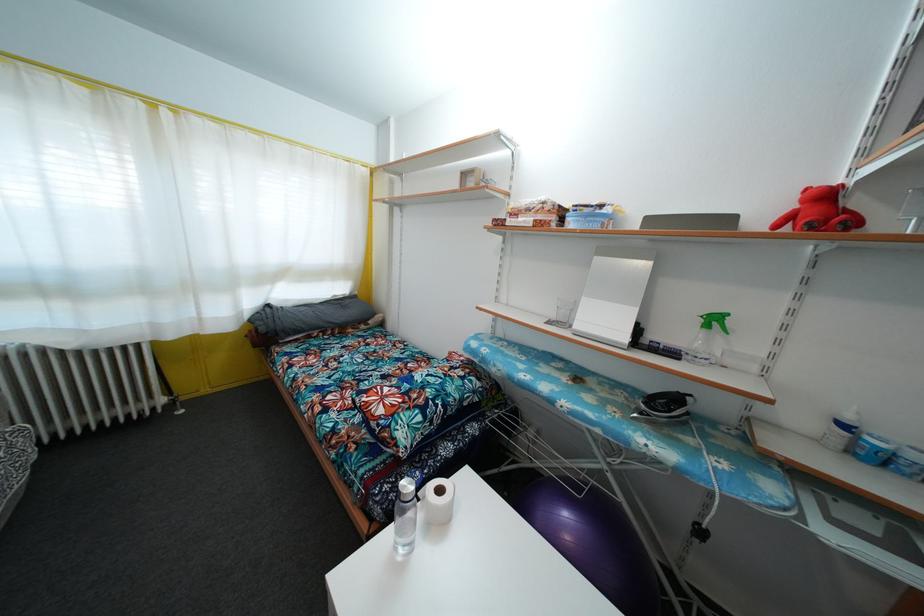
Which object does [565,312] point to?

It corresponds to the clear drinking glass in the image.